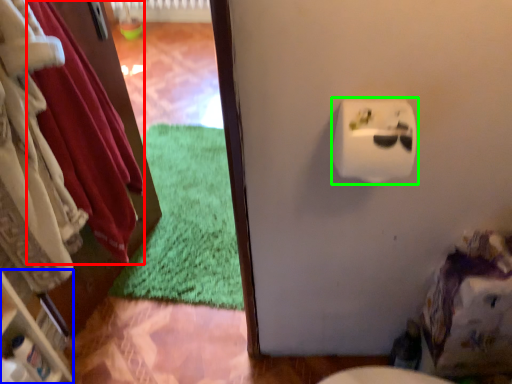
Question: Which object is positioned closest to clothing (highlighted by a red box)? Select from shelf (highlighted by a blue box) and toilet paper (highlighted by a green box).

Choices:
 (A) shelf
 (B) toilet paper

Answer: (A)